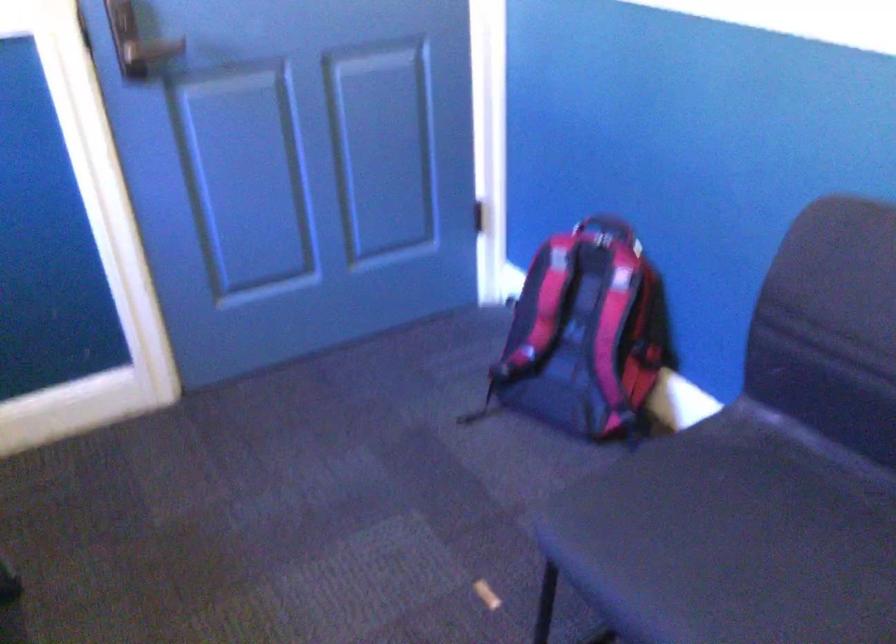
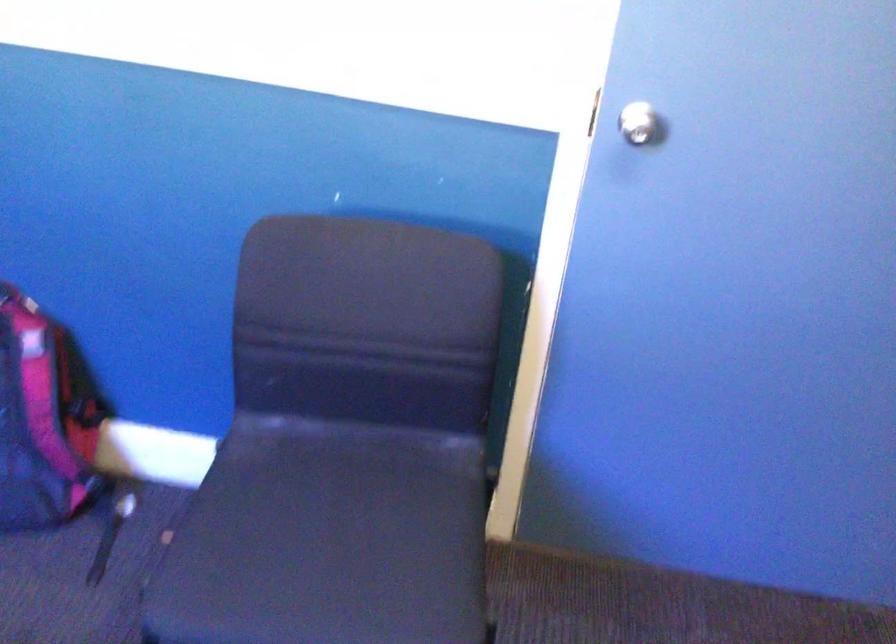
Question: How did the camera likely rotate?

Choices:
 (A) Left
 (B) Right
 (C) Up
 (D) Down

Answer: (B)